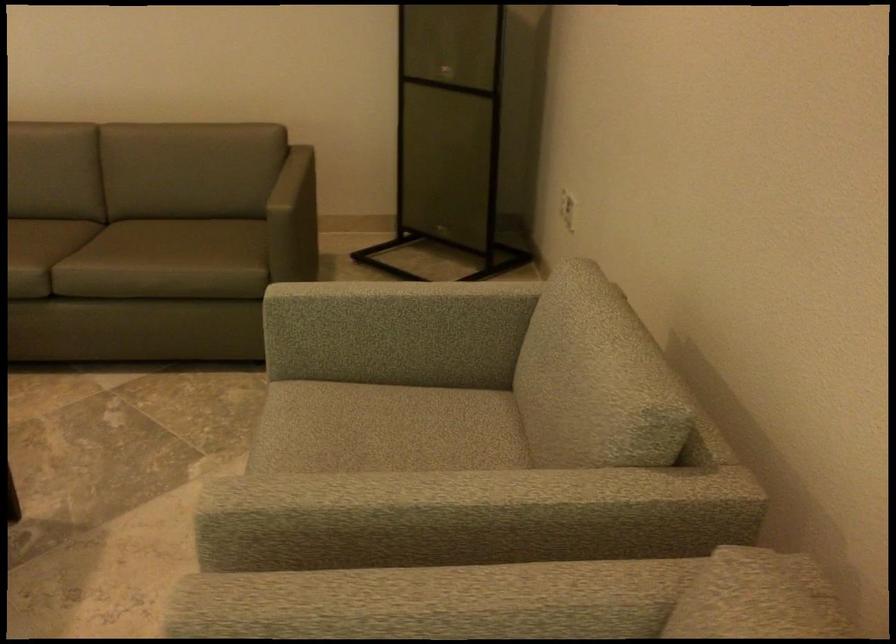
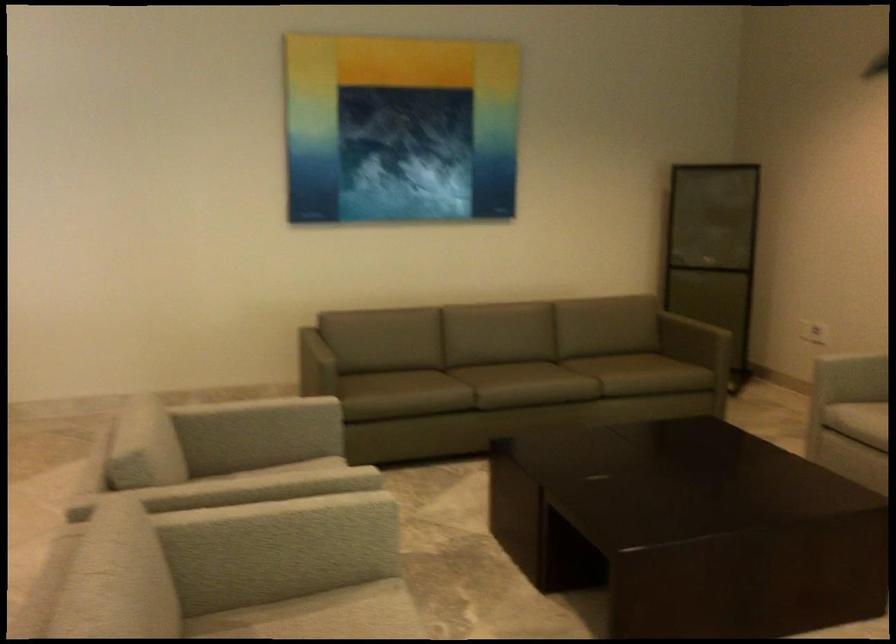
In the second image, find the point that corresponds to point 317,442 in the first image.

(857, 420)